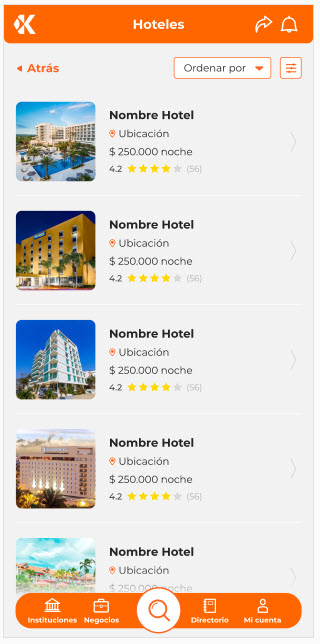
The image size is (320, 644). I want to click on box, so click(99, 603).